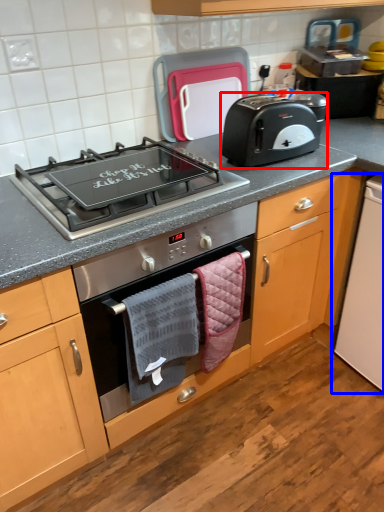
Question: Which object appears farthest to the camera in this image, toaster (highlighted by a red box) or appliance (highlighted by a blue box)?

Choices:
 (A) toaster
 (B) appliance

Answer: (B)